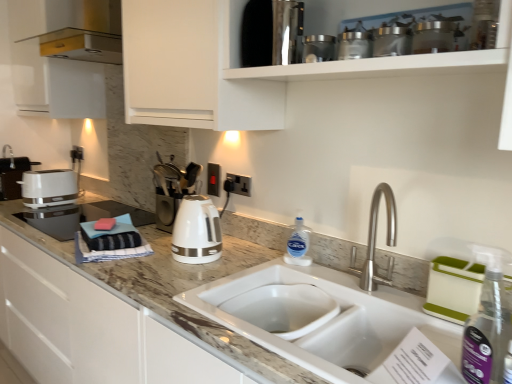
Question: Does point (498, 324) appear closer or farther from the camera than point (244, 276)?

Choices:
 (A) farther
 (B) closer

Answer: (B)

Question: From a real-world perspective, is clear plastic spray bottle at right, acting as the first bottle starting from the right, physically located above or below white ceramic sink at center?

Choices:
 (A) below
 (B) above

Answer: (B)

Question: Which of these objects is positioned farthest from the white ceramic sink at center?

Choices:
 (A) white glossy toaster at left, which is the first appliance from left to right
 (B) marble/granite countertop at center
 (C) metallic stainless steel container at upper center, which ranks as the 3th appliance in left-to-right order
 (D) white glossy toaster at left
 (E) white matte cabinet at upper center

Answer: (A)

Question: Estimate the real-world distances between objects in this image. Which object is farther from the white glossy toaster at left, arranged as the fifth appliance when viewed from the front?

Choices:
 (A) white glossy electric kettle at center
 (B) metallic silver canisters at upper center, which is the fourth appliance from back to front
 (C) metallic stainless steel container at upper center, the 3th appliance from the back
 (D) stainless steel coffee maker at upper center, acting as the 4th appliance starting from the right
 (E) metallic glass jars at upper center, acting as the 1th appliance starting from the front

Answer: (E)